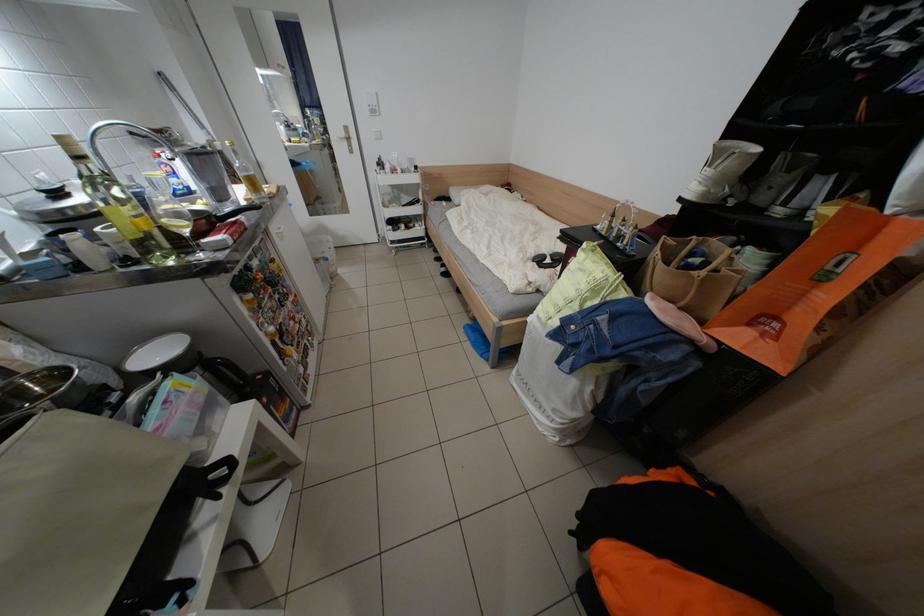
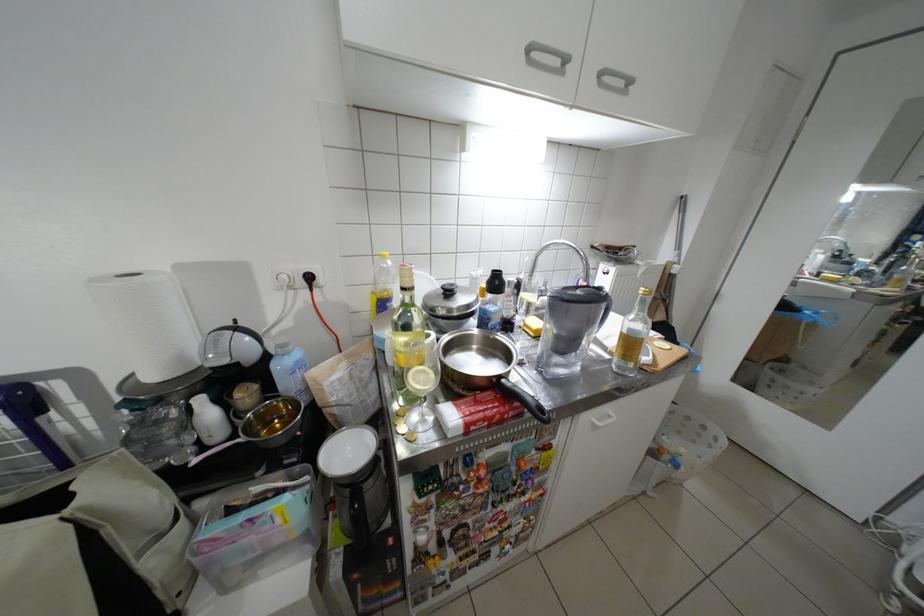
Question: How did the camera likely rotate?

Choices:
 (A) Left
 (B) Right
 (C) Up
 (D) Down

Answer: (A)